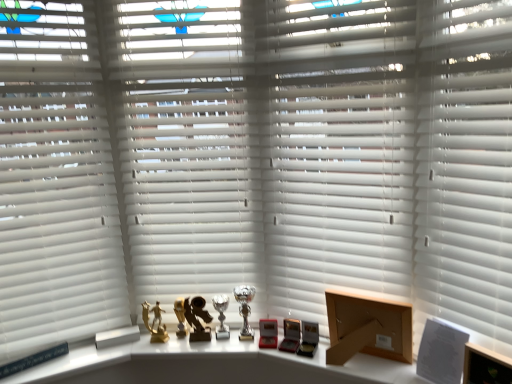
Question: Can you confirm if gold metallic trophy at center is thinner than white matte blinds at center, positioned as the 2th shutter in right-to-left order?

Choices:
 (A) yes
 (B) no

Answer: (A)

Question: Can you confirm if gold metallic trophy at center is shorter than white matte blinds at center, positioned as the 2th shutter in right-to-left order?

Choices:
 (A) no
 (B) yes

Answer: (B)

Question: From a real-world perspective, is gold metallic trophy at center located beneath white matte blinds at center, the 2th shutter positioned from the left?

Choices:
 (A) yes
 (B) no

Answer: (A)

Question: Is gold metallic trophy at center positioned with its back to white matte blinds at center, the 2th shutter positioned from the left?

Choices:
 (A) no
 (B) yes

Answer: (A)

Question: From a real-world perspective, is gold metallic trophy at center on white matte blinds at center, the 2th shutter positioned from the left?

Choices:
 (A) no
 (B) yes

Answer: (A)

Question: Looking at their shapes, would you say gold metallic figurine at center, which is counted as the second toy, starting from the right, is wider or thinner than white matte blinds at center, positioned as the 2th shutter in right-to-left order?

Choices:
 (A) wide
 (B) thin

Answer: (B)

Question: Is gold metallic figurine at center, which is counted as the second toy, starting from the right, inside the boundaries of white matte blinds at center, positioned as the 2th shutter in right-to-left order, or outside?

Choices:
 (A) inside
 (B) outside

Answer: (B)

Question: Is gold metallic figurine at center, placed as the 1th toy when sorted from left to right, in front of or behind white matte blinds at center, the 2th shutter positioned from the left, in the image?

Choices:
 (A) behind
 (B) front

Answer: (A)

Question: From their relative heights in the image, would you say gold metallic figurine at center, which is counted as the second toy, starting from the right, is taller or shorter than white matte blinds at center, positioned as the 2th shutter in right-to-left order?

Choices:
 (A) short
 (B) tall

Answer: (A)

Question: Is white matte shutter at center, positioned as the 1th shutter in right-to-left order, to the left or to the right of metallic trophies at center in the image?

Choices:
 (A) right
 (B) left

Answer: (A)

Question: Is point (446, 89) closer or farther from the camera than point (181, 347)?

Choices:
 (A) farther
 (B) closer

Answer: (B)

Question: Relative to metallic trophies at center, is white matte shutter at center, positioned as the 1th shutter in right-to-left order, in front or behind?

Choices:
 (A) behind
 (B) front

Answer: (A)

Question: From a real-world perspective, is white matte shutter at center, positioned as the 1th shutter in right-to-left order, physically located above or below metallic trophies at center?

Choices:
 (A) below
 (B) above

Answer: (B)

Question: In the image, is gold metallic figurine at center, placed as the 1th toy when sorted from left to right, on the left side or the right side of silver metallic trophy at center, acting as the first table lamp starting from the right?

Choices:
 (A) left
 (B) right

Answer: (A)

Question: From the image's perspective, is gold metallic figurine at center, which is counted as the second toy, starting from the right, located above or below silver metallic trophy at center, the second table lamp viewed from the left?

Choices:
 (A) below
 (B) above

Answer: (A)